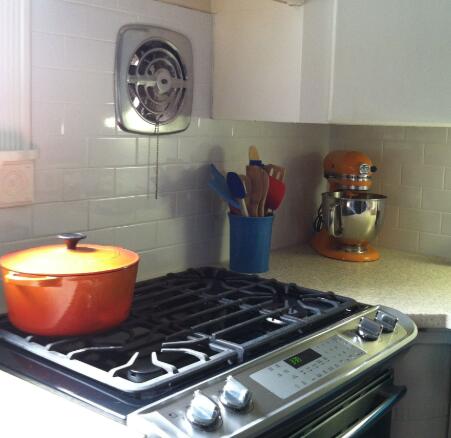
Find the location of a particular element. black lid handle is located at coordinates [70, 242].